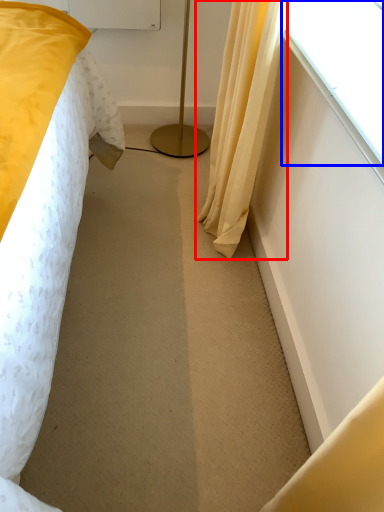
Question: Which object appears farthest to the camera in this image, curtain (highlighted by a red box) or window (highlighted by a blue box)?

Choices:
 (A) curtain
 (B) window

Answer: (A)